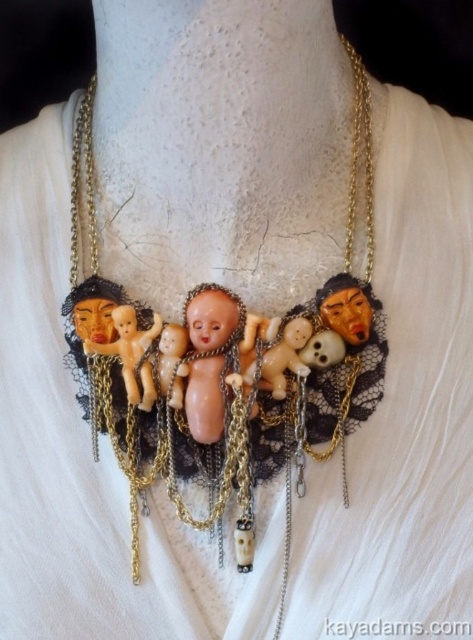
You are an appraiser examining the necklace. You notice two dolls at the center. Which doll is closer to you, the matte porcelain dolls at center or the pink porcelain doll at center?

The matte porcelain dolls at center are closer to you because they are positioned in front of the pink porcelain doll at center.

You are a jewelry designer examining the necklace. You notice two types of dolls on the necklace at the center. Which one is bigger between the matte porcelain dolls at center and the pink porcelain doll at center?

The matte porcelain dolls at center are bigger compared to the pink porcelain doll at center.